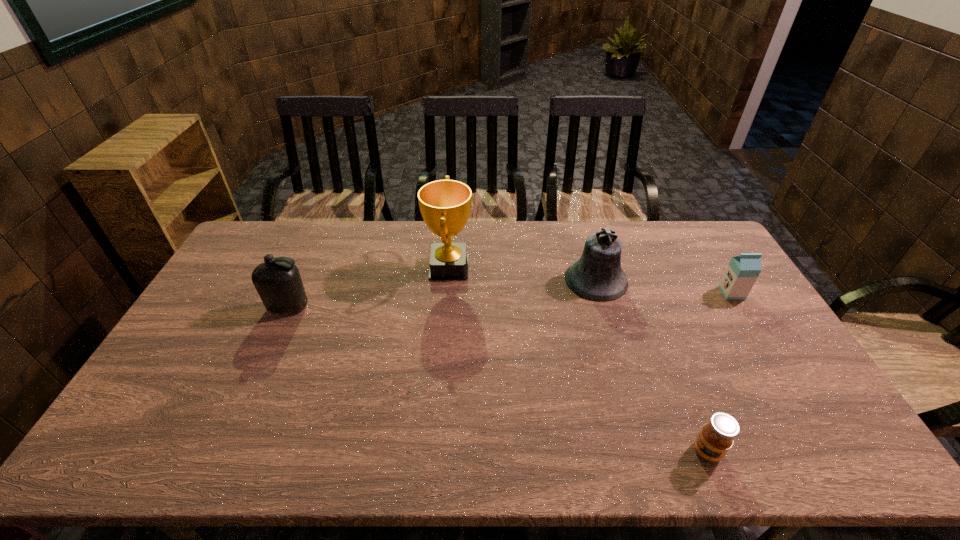
The width and height of the screenshot is (960, 540). In the image, there is a desktop. In order to click on free region at the near edge in this screenshot , I will do `click(632, 451)`.

Where is `free space at the left edge of the desktop`? The image size is (960, 540). free space at the left edge of the desktop is located at coordinates click(x=226, y=289).

This screenshot has width=960, height=540. In the image, there is a desktop. What are the coordinates of `free space at the right edge` in the screenshot? It's located at (818, 406).

I want to click on free space between the milk carton and the bell, so click(663, 287).

This screenshot has width=960, height=540. Find the location of `vacant space in between the third object from left to right and the honey`. vacant space in between the third object from left to right and the honey is located at coordinates pos(652,366).

Locate an element on the screen. Image resolution: width=960 pixels, height=540 pixels. vacant area that lies between the award and the leftmost object is located at coordinates (369, 287).

At what (x,y) coordinates should I click in order to perform the action: click on empty space that is in between the leftmost object and the third object from left to right. Please return your answer as a coordinate pair (x, y). Looking at the image, I should click on (443, 294).

The image size is (960, 540). In order to click on free space between the bell and the fourth object from right to left in this screenshot , I will do `click(522, 274)`.

I want to click on empty location between the award and the third object from left to right, so click(522, 274).

I want to click on vacant space that is in between the third object from right to left and the fourth object from right to left, so click(x=522, y=274).